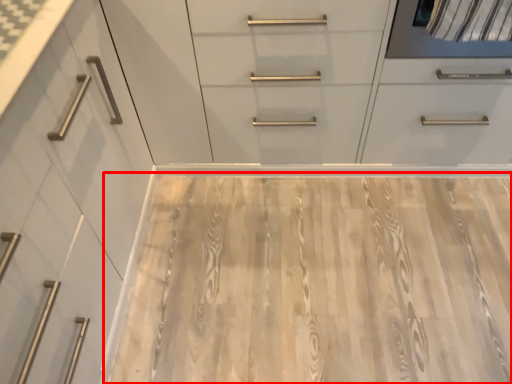
Question: Observing the image, what is the correct spatial positioning of plywood (annotated by the red box) in reference to dresser?

Choices:
 (A) left
 (B) right

Answer: (B)